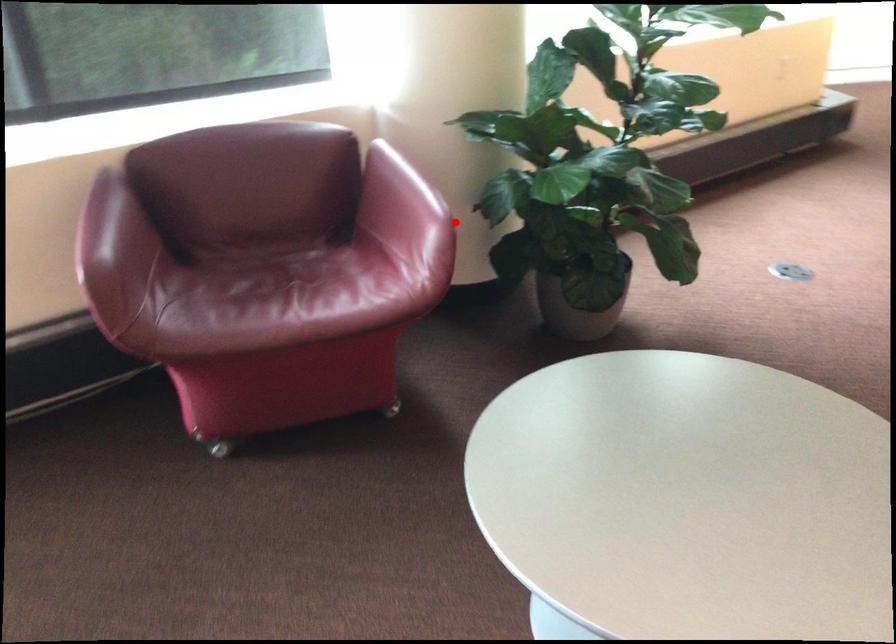
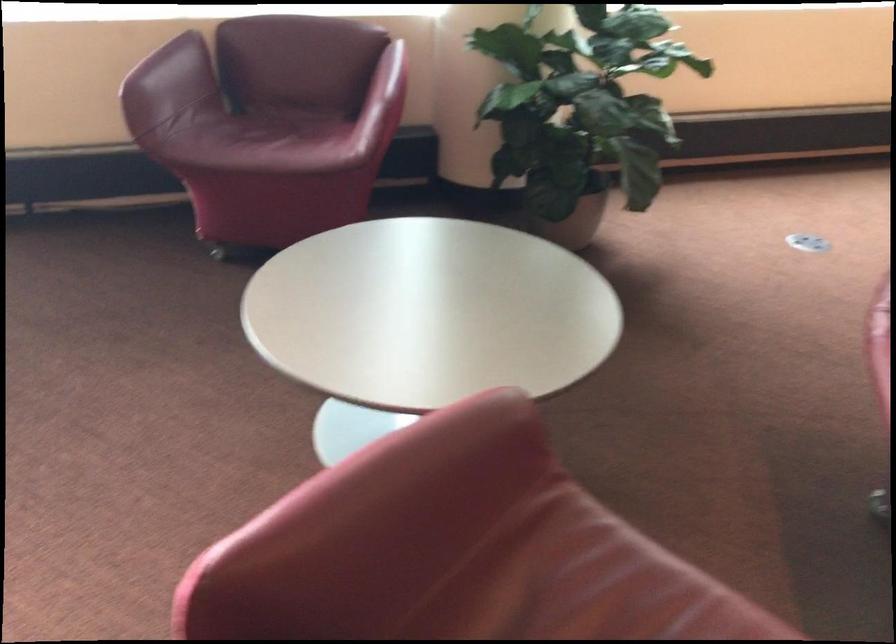
Question: I am providing you with two images of the same scene from different viewpoints. Image1 has a red point marked. In image2, the corresponding 3D location appears at what relative position? Reply with the corresponding letter.

Choices:
 (A) Closer
 (B) Farther

Answer: (B)